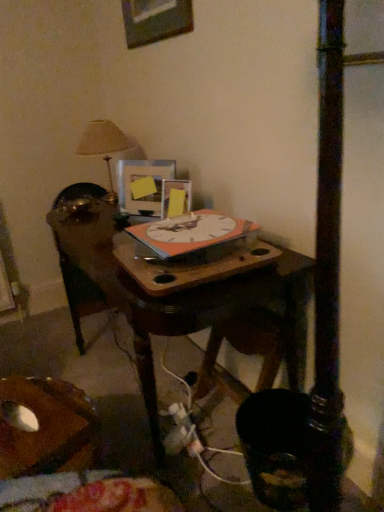
This screenshot has width=384, height=512. In order to click on white plastic plug at lower center in this screenshot , I will do `click(181, 432)`.

The image size is (384, 512). Describe the element at coordinates (169, 194) in the screenshot. I see `matte plastic picture frame at center, marked as the 3th picture frame in a top-to-bottom arrangement` at that location.

This screenshot has width=384, height=512. Find the location of `matte plastic picture frame at center, marked as the 3th picture frame in a top-to-bottom arrangement`. matte plastic picture frame at center, marked as the 3th picture frame in a top-to-bottom arrangement is located at coordinates [x=169, y=194].

What is the approximate width of wooden picture frame at upper center, marked as the first picture frame in a top-to-bottom arrangement?

1.53 inches.

This screenshot has height=512, width=384. What do you see at coordinates (155, 20) in the screenshot?
I see `wooden picture frame at upper center, marked as the first picture frame in a top-to-bottom arrangement` at bounding box center [155, 20].

At what (x,y) coordinates should I click in order to perform the action: click on matte beige lampshade at upper left. Please return your answer as a coordinate pair (x, y). Image resolution: width=384 pixels, height=512 pixels. Looking at the image, I should click on (103, 146).

I want to click on white plastic plug at lower center, so click(181, 432).

From a real-world perspective, between white plastic plug at lower center and orange matte clock at center, who is vertically lower?

From a 3D spatial view, white plastic plug at lower center is below.

Is white plastic plug at lower center not close to orange matte clock at center?

No, white plastic plug at lower center is not far away from orange matte clock at center.

Which of these two, white plastic plug at lower center or orange matte clock at center, stands shorter?

Standing shorter between the two is orange matte clock at center.

Who is bigger, matte plastic picture frame at center, which is the second picture frame from bottom to top, or orange matte clock at center?

Bigger between the two is orange matte clock at center.

Is matte plastic picture frame at center, the 2th picture frame in the top-to-bottom sequence, not inside orange matte clock at center?

Absolutely, matte plastic picture frame at center, the 2th picture frame in the top-to-bottom sequence, is external to orange matte clock at center.

Which object is wider, matte plastic picture frame at center, the 2th picture frame in the top-to-bottom sequence, or orange matte clock at center?

orange matte clock at center is wider.

Is wooden table at center facing away from white plastic plug at lower center?

No, wooden table at center is not facing away from white plastic plug at lower center.

Do you think wooden table at center is within white plastic plug at lower center, or outside of it?

wooden table at center is not inside white plastic plug at lower center, it's outside.

From a real-world perspective, is wooden table at center below white plastic plug at lower center?

Incorrect, from a real-world perspective, wooden table at center is higher than white plastic plug at lower center.

At what (x,y) coordinates should I click in order to perform the action: click on plug on the right of wooden table at center. Please return your answer as a coordinate pair (x, y). The height and width of the screenshot is (512, 384). Looking at the image, I should click on (181, 432).

Would you say orange matte clock at center contains matte plastic picture frame at center, which is counted as the first picture frame, starting from the bottom?

No, matte plastic picture frame at center, which is counted as the first picture frame, starting from the bottom, is located outside of orange matte clock at center.

Can you confirm if orange matte clock at center is taller than matte plastic picture frame at center, which is counted as the first picture frame, starting from the bottom?

No.

From a real-world perspective, who is located lower, orange matte clock at center or matte plastic picture frame at center, marked as the 3th picture frame in a top-to-bottom arrangement?

matte plastic picture frame at center, marked as the 3th picture frame in a top-to-bottom arrangement.

Which of these two, orange matte clock at center or matte plastic picture frame at center, which is counted as the first picture frame, starting from the bottom, is bigger?

orange matte clock at center.

Could you tell me if white plastic plug at lower center is turned towards matte plastic picture frame at center, the 2th picture frame in the top-to-bottom sequence?

No.

Does white plastic plug at lower center have a larger size compared to matte plastic picture frame at center, which is the second picture frame from bottom to top?

No.

Is white plastic plug at lower center at the left side of matte plastic picture frame at center, which is the second picture frame from bottom to top?

Incorrect, white plastic plug at lower center is not on the left side of matte plastic picture frame at center, which is the second picture frame from bottom to top.

From a real-world perspective, between wooden table at center and matte beige lampshade at upper left, who is vertically lower?

wooden table at center.

Between point (201, 288) and point (91, 122), which one is positioned behind?

Positioned behind is point (91, 122).

Is wooden table at center taller than matte beige lampshade at upper left?

Correct, wooden table at center is much taller as matte beige lampshade at upper left.

Does wooden table at center have a greater width compared to matte beige lampshade at upper left?

Correct, the width of wooden table at center exceeds that of matte beige lampshade at upper left.

From the picture: Considering the sizes of wooden picture frame at upper center, marked as the first picture frame in a top-to-bottom arrangement, and white plastic plug at lower center in the image, is wooden picture frame at upper center, marked as the first picture frame in a top-to-bottom arrangement, bigger or smaller than white plastic plug at lower center?

In the image, wooden picture frame at upper center, marked as the first picture frame in a top-to-bottom arrangement, appears to be larger than white plastic plug at lower center.

How different are the orientations of wooden picture frame at upper center, positioned as the third picture frame in bottom-to-top order, and white plastic plug at lower center in degrees?

5.03 degrees.

Considering the points (180, 19) and (199, 452), which point is in front, point (180, 19) or point (199, 452)?

Positioned in front is point (199, 452).

At what (x,y) coordinates should I click in order to perform the action: click on picture frame that is the 1st one when counting backward from the white plastic plug at lower center. Please return your answer as a coordinate pair (x, y). The image size is (384, 512). Looking at the image, I should click on (155, 20).

The height and width of the screenshot is (512, 384). Identify the location of clock that appears above the white plastic plug at lower center (from a real-world perspective). (189, 233).

Identify the location of clock on the right side of matte plastic picture frame at center, which is the second picture frame from bottom to top. The width and height of the screenshot is (384, 512). (189, 233).

Considering their positions, is white plastic plug at lower center positioned further to wooden picture frame at upper center, marked as the first picture frame in a top-to-bottom arrangement, than matte plastic picture frame at center, marked as the 3th picture frame in a top-to-bottom arrangement?

white plastic plug at lower center lies further to wooden picture frame at upper center, marked as the first picture frame in a top-to-bottom arrangement, than the other object.

Looking at the image, which one is located closer to matte plastic picture frame at center, which is the second picture frame from bottom to top, wooden table at center or matte plastic picture frame at center, marked as the 3th picture frame in a top-to-bottom arrangement?

The object closer to matte plastic picture frame at center, which is the second picture frame from bottom to top, is matte plastic picture frame at center, marked as the 3th picture frame in a top-to-bottom arrangement.

When comparing their distances from white plastic plug at lower center, does wooden table at center or wooden picture frame at upper center, marked as the first picture frame in a top-to-bottom arrangement, seem further?

wooden picture frame at upper center, marked as the first picture frame in a top-to-bottom arrangement.

Looking at this image, estimate the real-world distances between objects in this image. Which object is closer to wooden table at center, orange matte clock at center or matte plastic picture frame at center, the 2th picture frame in the top-to-bottom sequence?

Based on the image, orange matte clock at center appears to be nearer to wooden table at center.

From the picture: From the image, which object appears to be farther from wooden table at center, matte beige lampshade at upper left or matte plastic picture frame at center, which is the second picture frame from bottom to top?

matte beige lampshade at upper left.

Considering their positions, is matte plastic picture frame at center, which is counted as the first picture frame, starting from the bottom, positioned closer to wooden picture frame at upper center, marked as the first picture frame in a top-to-bottom arrangement, than white plastic plug at lower center?

matte plastic picture frame at center, which is counted as the first picture frame, starting from the bottom, lies closer to wooden picture frame at upper center, marked as the first picture frame in a top-to-bottom arrangement, than the other object.

Looking at the image, which one is located closer to white plastic plug at lower center, matte plastic picture frame at center, which is the second picture frame from bottom to top, or matte plastic picture frame at center, which is counted as the first picture frame, starting from the bottom?

The object closer to white plastic plug at lower center is matte plastic picture frame at center, which is counted as the first picture frame, starting from the bottom.

From the picture: Which object lies nearer to the anchor point matte beige lampshade at upper left, matte plastic picture frame at center, which is counted as the first picture frame, starting from the bottom, or orange matte clock at center?

Among the two, matte plastic picture frame at center, which is counted as the first picture frame, starting from the bottom, is located nearer to matte beige lampshade at upper left.

Locate an element on the screen. This screenshot has height=512, width=384. table between orange matte clock at center and white plastic plug at lower center in the up-down direction is located at coordinates point(184,298).

This screenshot has height=512, width=384. Identify the location of table lamp between wooden picture frame at upper center, positioned as the third picture frame in bottom-to-top order, and matte plastic picture frame at center, which is the second picture frame from bottom to top, in the vertical direction. (103, 146).

I want to click on table lamp between wooden picture frame at upper center, positioned as the third picture frame in bottom-to-top order, and matte plastic picture frame at center, marked as the 3th picture frame in a top-to-bottom arrangement, in the vertical direction, so click(103, 146).

Find the location of `picture frame between matte plastic picture frame at center, which is the second picture frame from bottom to top, and white plastic plug at lower center vertically`. picture frame between matte plastic picture frame at center, which is the second picture frame from bottom to top, and white plastic plug at lower center vertically is located at coordinates (169, 194).